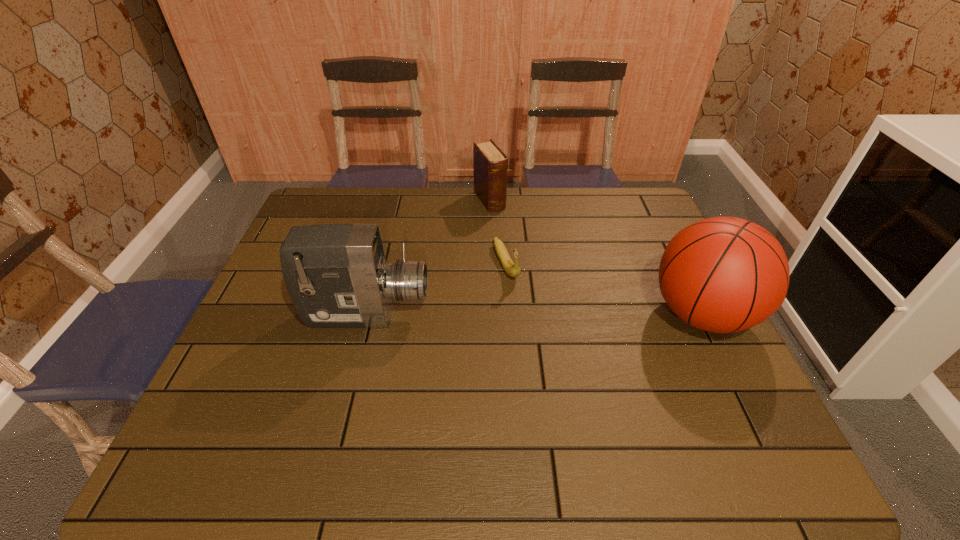
Identify the location of free spot on the desktop that is between the camcorder and the rightmost object and is positioned on the spine side of the third tallest object. (572, 314).

Where is `free spot on the desktop that is between the leftmost object and the rightmost object and is positioned at the stem of the banana`? The width and height of the screenshot is (960, 540). free spot on the desktop that is between the leftmost object and the rightmost object and is positioned at the stem of the banana is located at coordinates (533, 314).